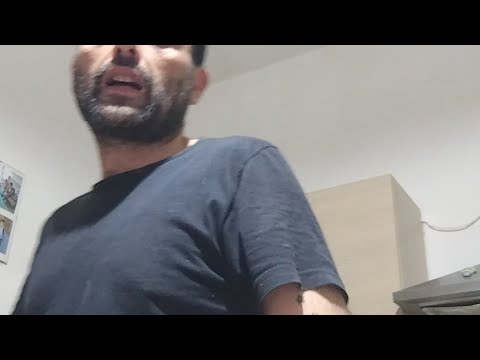
Locate an element on the screen. Image resolution: width=480 pixels, height=360 pixels. chest is located at coordinates (104, 223).